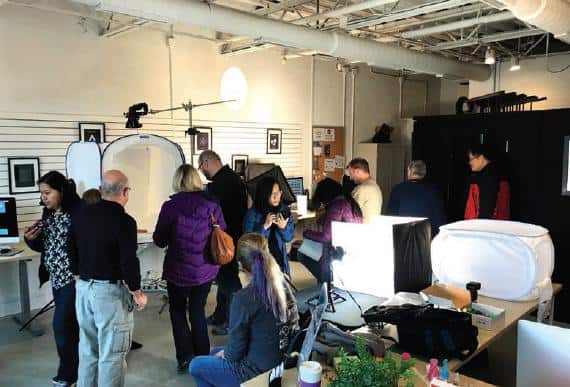
Identify the location of monitor. This screenshot has width=570, height=387. (12, 223).